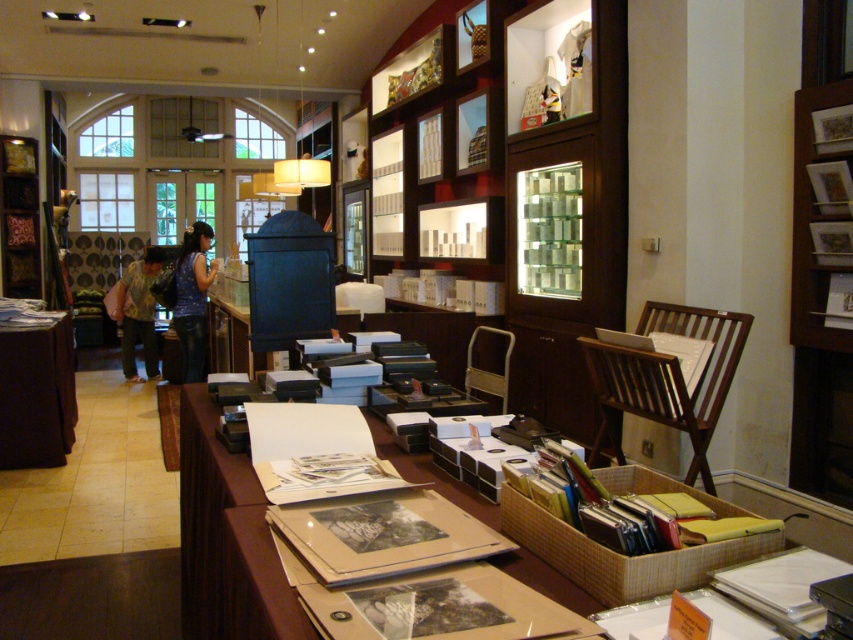
Between brown cardboard table at center and yellow floral blouse at center, which one is positioned lower?

brown cardboard table at center is lower down.

Between brown cardboard table at center and yellow floral blouse at center, which one appears on the right side from the viewer's perspective?

brown cardboard table at center

Measure the distance between brown cardboard table at center and camera.

39.18 inches

Locate an element on the screen. brown cardboard table at center is located at coordinates 225,540.

Is brown cardboard table at center taller than wooden bookshelf at upper right?

No, brown cardboard table at center is not taller than wooden bookshelf at upper right.

Can you confirm if brown cardboard table at center is bigger than wooden bookshelf at upper right?

Correct, brown cardboard table at center is larger in size than wooden bookshelf at upper right.

Is point (477, 512) more distant than point (848, 99)?

No.

Locate an element on the screen. The width and height of the screenshot is (853, 640). brown cardboard table at center is located at coordinates (225, 540).

Can you confirm if brown cardboard table at center is positioned to the right of wooden bookshelf at left?

Correct, you'll find brown cardboard table at center to the right of wooden bookshelf at left.

Who is positioned more to the right, brown cardboard table at center or wooden bookshelf at left?

Positioned to the right is brown cardboard table at center.

Where is `brown cardboard table at center`? Image resolution: width=853 pixels, height=640 pixels. brown cardboard table at center is located at coordinates (225, 540).